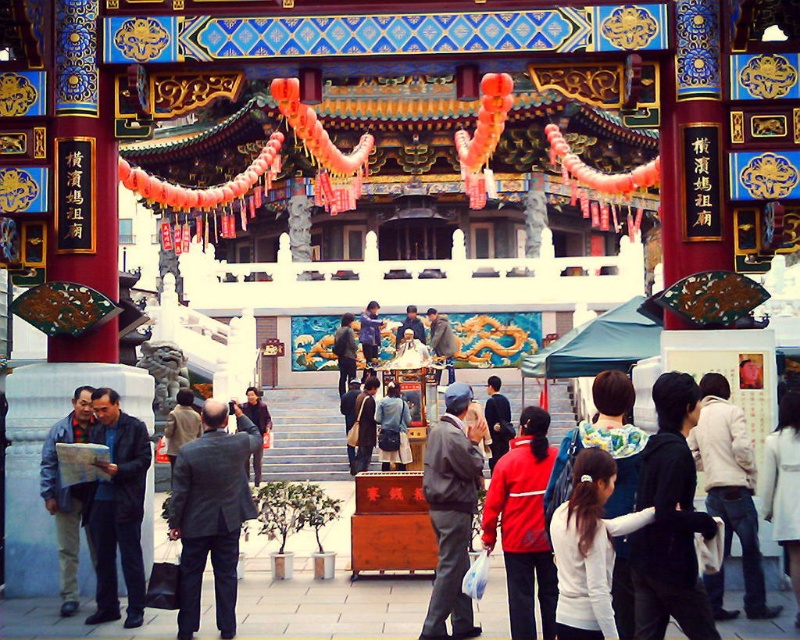
Question: Which of these objects is positioned farthest from the dark gray suit at center?

Choices:
 (A) black fabric jacket at lower right
 (B) denim jacket at center
 (C) red matte jacket at center

Answer: (A)

Question: Is gray fabric jacket at center above denim jacket at center?

Choices:
 (A) no
 (B) yes

Answer: (B)

Question: Does black fabric jacket at lower right appear over dark gray fabric jacket at center?

Choices:
 (A) no
 (B) yes

Answer: (A)

Question: Which point is closer to the camera?

Choices:
 (A) denim jacket at center
 (B) black fabric jacket at lower right
 (C) dark gray fabric jacket at center
 (D) white wool coat at lower right

Answer: (B)

Question: Where is white fabric hairband at center located in relation to white wool coat at lower right in the image?

Choices:
 (A) left
 (B) right

Answer: (A)

Question: Among these points, which one is nearest to the camera?

Choices:
 (A) (556, 548)
 (B) (262, 438)
 (C) (780, 461)
 (D) (396, 404)

Answer: (A)